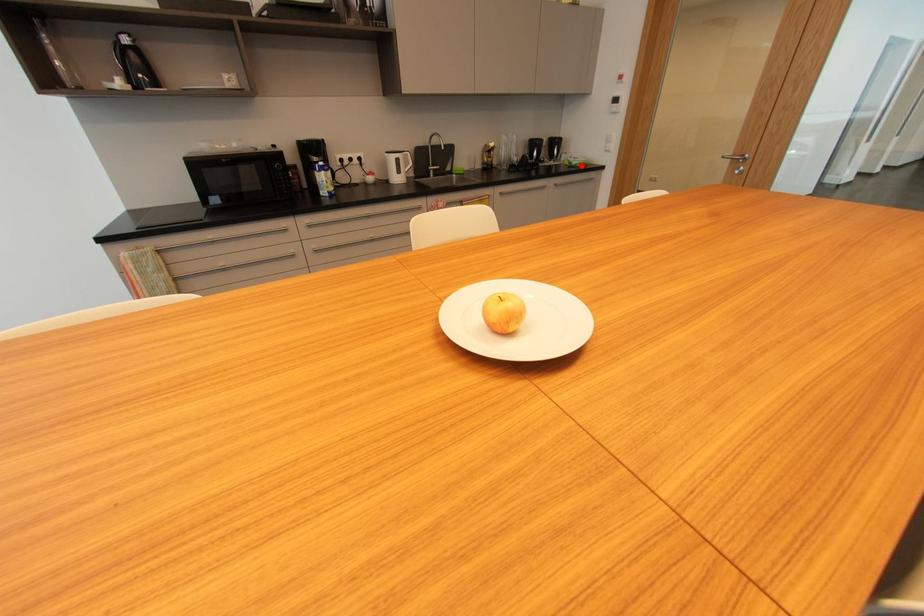
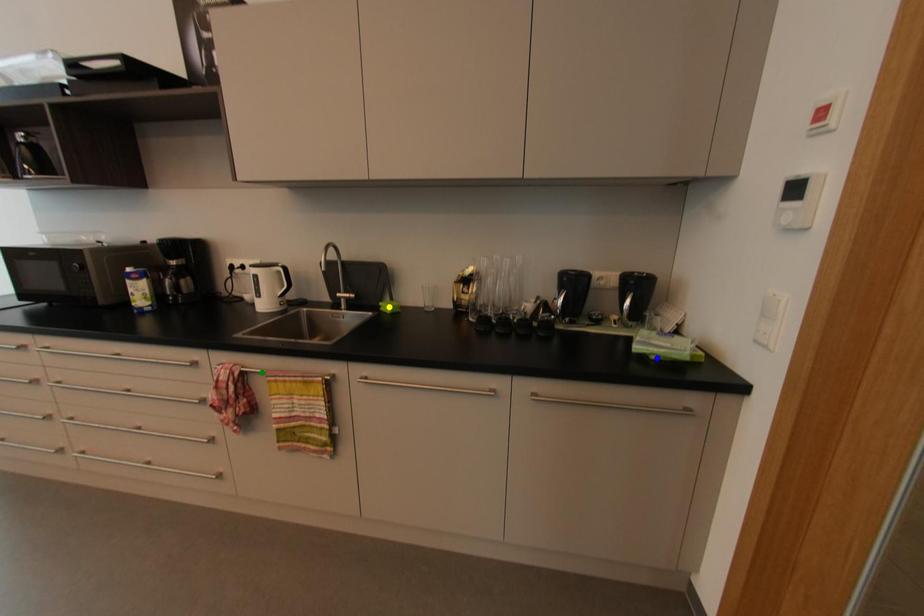
Question: I am providing you with two images of the same scene from different viewpoints. A red point is marked on the first image. You are given multiple points on the second image. Which point in image 2 is actually the same real-world point as the red point in image 1?

Choices:
 (A) blue point
 (B) yellow point
 (C) green point

Answer: (A)